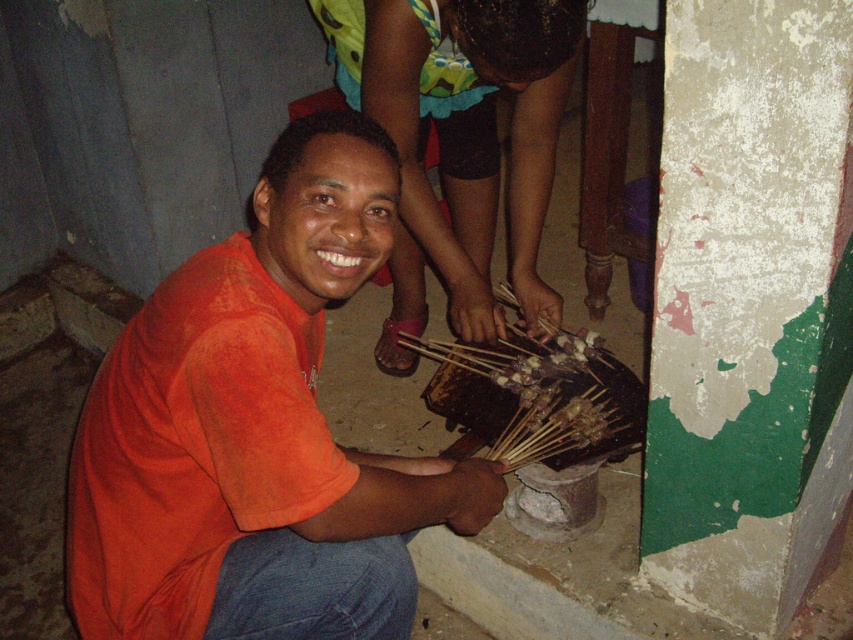
You are a photographer trying to capture a clear photo of the orange cotton shirt at center and the orange matte shirt at center. Which one is closer to the camera?

The orange cotton shirt at center is closer to the camera because it is in front of the orange matte shirt at center.

You are standing in the scene and want to reach the point at coordinates point (x=236, y=404). If you take a step forward, will you move closer to that point?

Yes, because the point (x=236, y=404) is 1.36 meters away from the viewer. Taking a step forward would reduce the distance between you and the point.

You are a photographer trying to capture the man in the orange cotton shirt at center and the orange matte shirt at center. Which shirt is closer to the camera?

The orange cotton shirt at center is positioned under the orange matte shirt at center, so the orange matte shirt at center is closer to the camera.